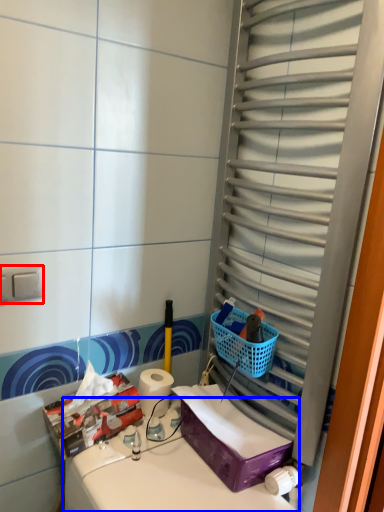
Question: Among these objects, which one is nearest to the camera, electric outlet (highlighted by a red box) or counter top (highlighted by a blue box)?

Choices:
 (A) electric outlet
 (B) counter top

Answer: (B)